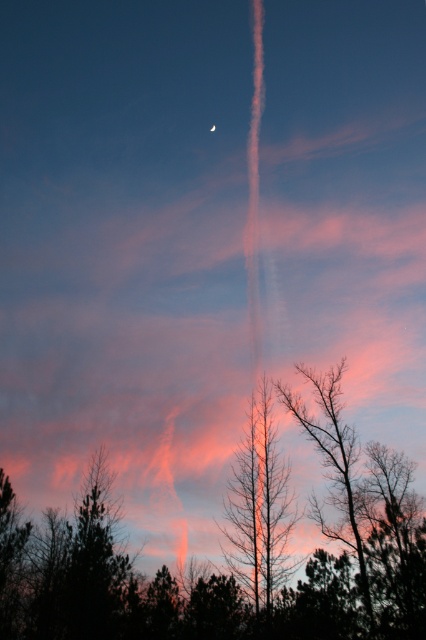
Does silhouette bare tree at center appear on the right side of bare branches at center?

In fact, silhouette bare tree at center is to the left of bare branches at center.

Is silhouette bare tree at center taller than bare branches at center?

Indeed, silhouette bare tree at center has a greater height compared to bare branches at center.

Is point (388, 464) less distant than point (229, 531)?

That is False.

Locate an element on the screen. silhouette bare tree at center is located at coordinates (213, 573).

Is silhouette bare tree at center smaller than bare branches at lower right?

Incorrect, silhouette bare tree at center is not smaller in size than bare branches at lower right.

Does point (97, 474) lie behind point (310, 513)?

Yes.

Identify the location of silhouette bare tree at center. (213, 573).

Which of these two, bare branches at center or bare branches at lower right, stands taller?

bare branches at lower right

Does bare branches at center appear under bare branches at lower right?

Yes, bare branches at center is below bare branches at lower right.

Image resolution: width=426 pixels, height=640 pixels. Identify the location of bare branches at center. pyautogui.click(x=259, y=509).